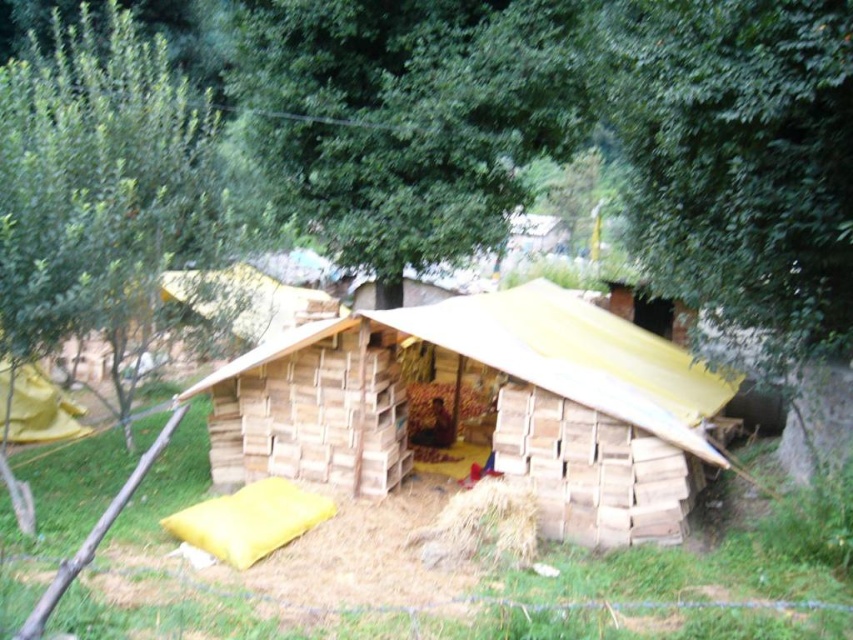
Question: Can you confirm if green leafy tree at upper left is positioned to the left of wooden planks at center?

Choices:
 (A) no
 (B) yes

Answer: (B)

Question: Which point is closer to the camera?

Choices:
 (A) green leafy tree at upper left
 (B) brown straw at lower center
 (C) wooden planks at center
 (D) green leafy tree at upper center

Answer: (B)

Question: Can you confirm if green leafy tree at upper center is wider than green leafy tree at upper left?

Choices:
 (A) no
 (B) yes

Answer: (B)

Question: Does green leafy tree at upper center appear on the left side of wooden planks at center?

Choices:
 (A) yes
 (B) no

Answer: (A)

Question: Which of these objects is positioned farthest from the wooden hut at center?

Choices:
 (A) green leafy tree at upper left
 (B) green leafy tree at upper center
 (C) wooden planks at center

Answer: (B)

Question: Based on their relative distances, which object is farther from the wooden planks at center?

Choices:
 (A) green leafy tree at upper center
 (B) green leafy tree at upper left

Answer: (B)